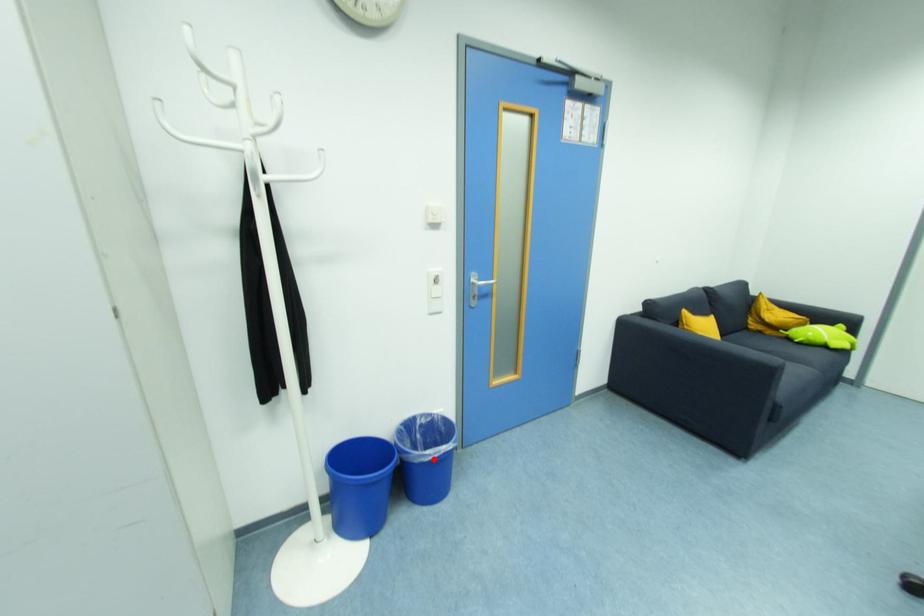
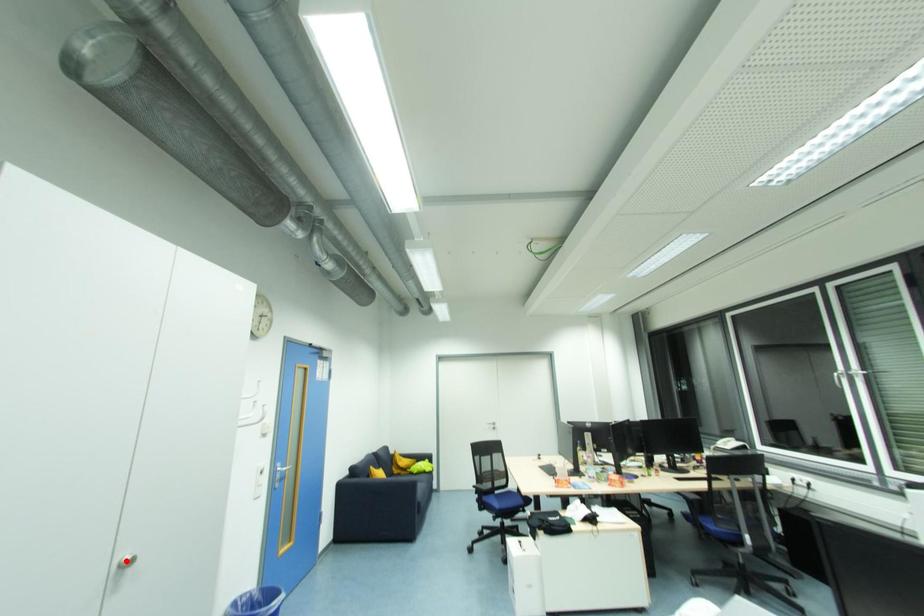
I am providing you with two images of the same scene from different viewpoints. A red point is marked on the first image and another point is marked on the second image. Do the highlighted points in image1 and image2 indicate the same real-world spot?

No